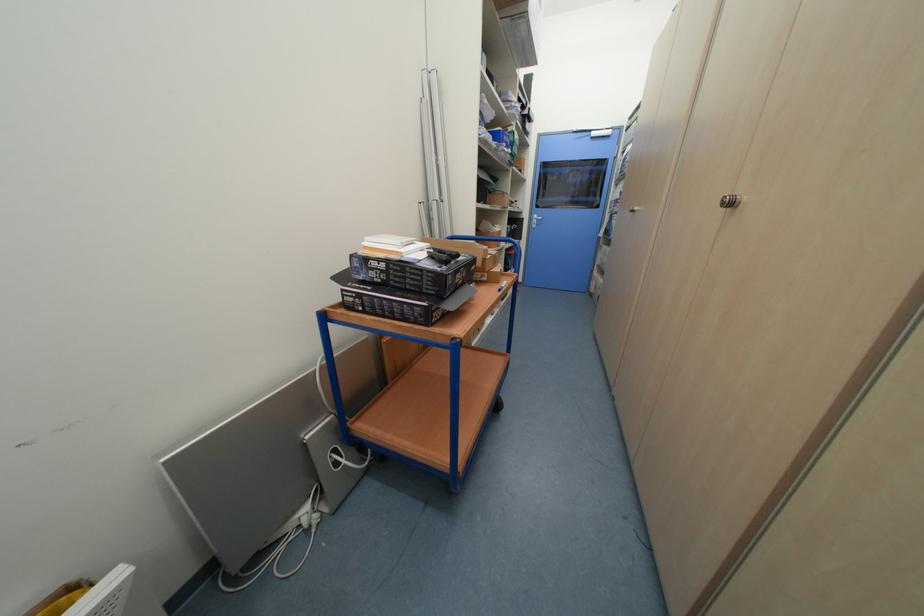
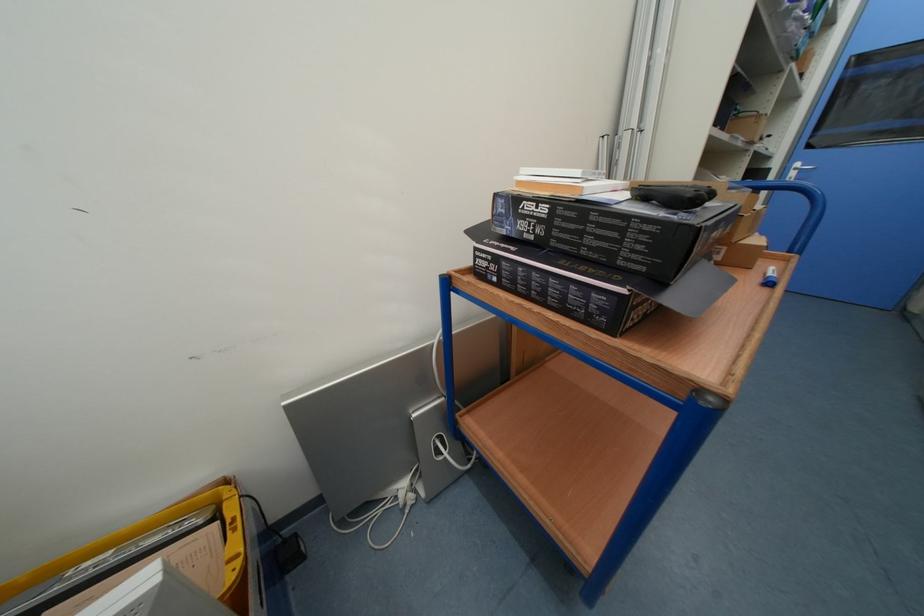
The point at (365, 297) is marked in the first image. Where is the corresponding point in the second image?

(502, 261)